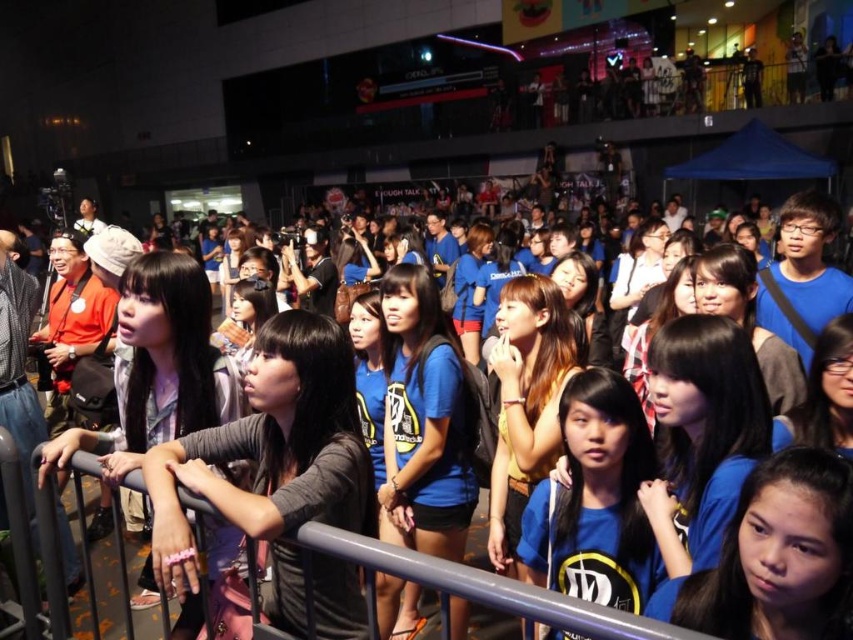
You are a photographer at the event and want to capture a photo of the blue fabric crowd at center without the gray metallic rail at center blocking the view. Is it possible to angle your camera upwards to achieve this?

The blue fabric crowd at center is located below the gray metallic rail at center, so angling the camera upwards would allow you to capture the blue fabric crowd at center without the rail obstructing the view.

You are a photographer at the event and want to capture a photo that includes both the blue fabric crowd at center and the gray metallic rail at center. Which object should you focus on first to ensure both are in sharp focus?

To ensure both the blue fabric crowd at center and the gray metallic rail at center are in sharp focus, focus on the gray metallic rail at center first since it is farther away from the viewer compared to the blue fabric crowd at center. This way, the depth of field will cover both objects effectively.

You are a photographer at the event and want to capture a photo of the gray metallic rail at center without including the blue fabric crowd at center. Given their sizes, is this possible?

The blue fabric crowd at center has a smaller size compared to the gray metallic rail at center. Therefore, it is possible to capture a photo of the gray metallic rail at center without including the blue fabric crowd at center by framing the shot to exclude the smaller crowd.